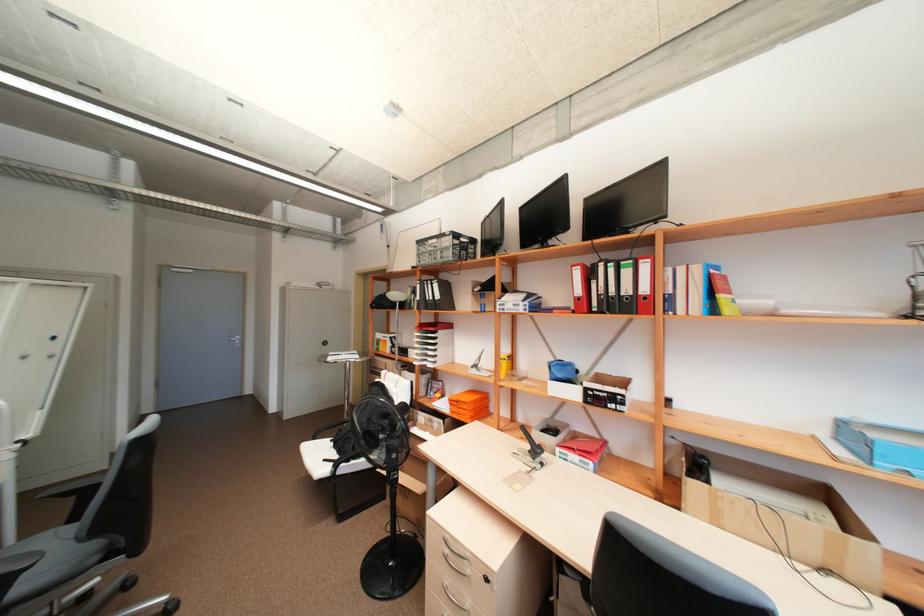
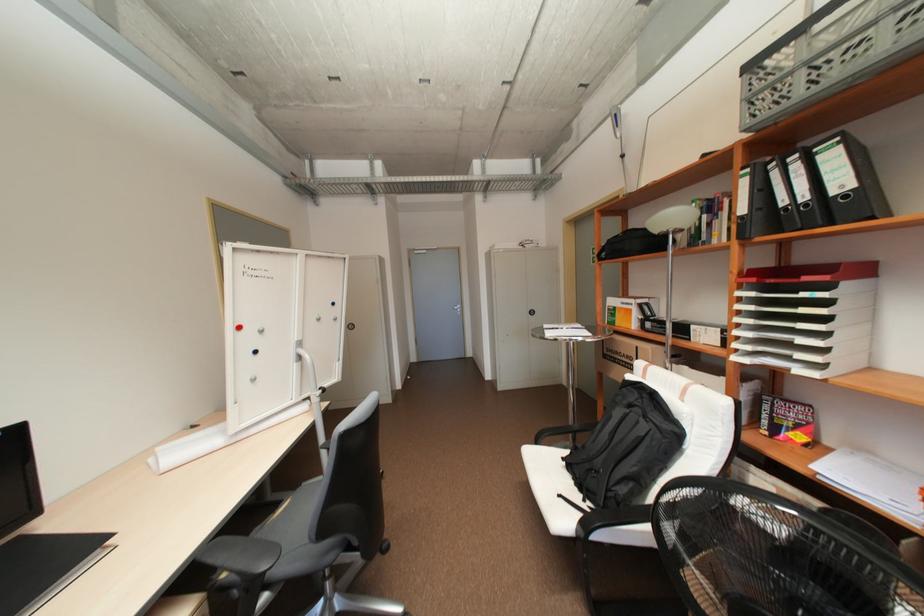
Where in the second image is the point corresponding to point (440, 403) from the first image?

(820, 467)